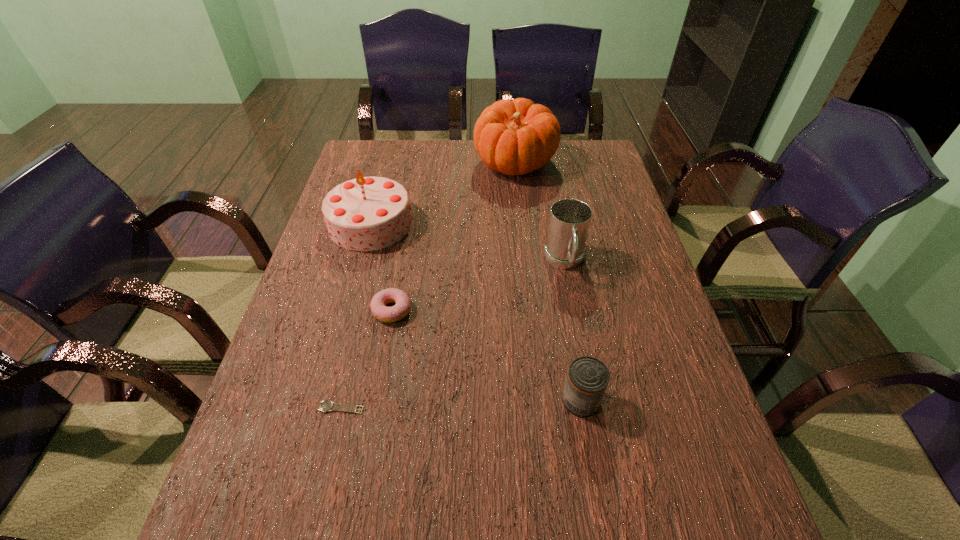
Locate an element on the screen. The image size is (960, 540). free space between the mug and the fourth farthest object is located at coordinates (478, 286).

Identify the location of vacant area between the birthday cake and the doughnut. This screenshot has width=960, height=540. (381, 267).

At what (x,y) coordinates should I click in order to perform the action: click on free space that is in between the fifth tallest object and the mug. Please return your answer as a coordinate pair (x, y). Image resolution: width=960 pixels, height=540 pixels. Looking at the image, I should click on (478, 286).

Where is `free space between the third shortest object and the watch`? This screenshot has height=540, width=960. free space between the third shortest object and the watch is located at coordinates (461, 404).

I want to click on free space between the watch and the birthday cake, so click(356, 315).

Identify the location of free space between the shortest object and the farthest object. This screenshot has width=960, height=540. (428, 286).

At what (x,y) coordinates should I click in order to perform the action: click on vacant area that lies between the can and the farthest object. Please return your answer as a coordinate pair (x, y). This screenshot has height=540, width=960. Looking at the image, I should click on (548, 282).

Locate an element on the screen. This screenshot has width=960, height=540. vacant area that lies between the farthest object and the second shortest object is located at coordinates (453, 237).

This screenshot has width=960, height=540. What are the coordinates of `free space that is in between the third tallest object and the pumpkin` in the screenshot? It's located at (540, 213).

Identify the location of object that is the fourth closest to the fourth shortest object. (367, 213).